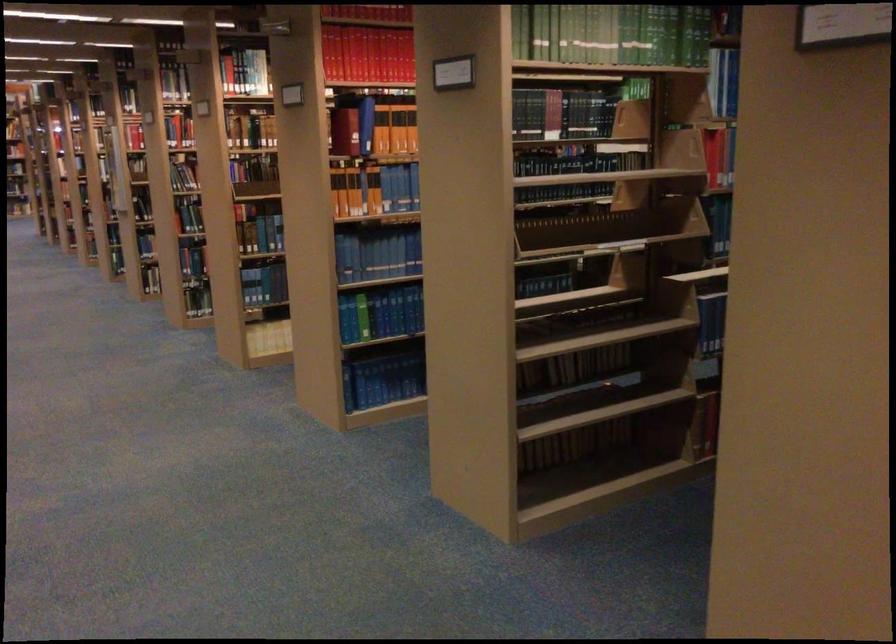
The location [394,140] corresponds to which object?

It corresponds to the orange book in the image.